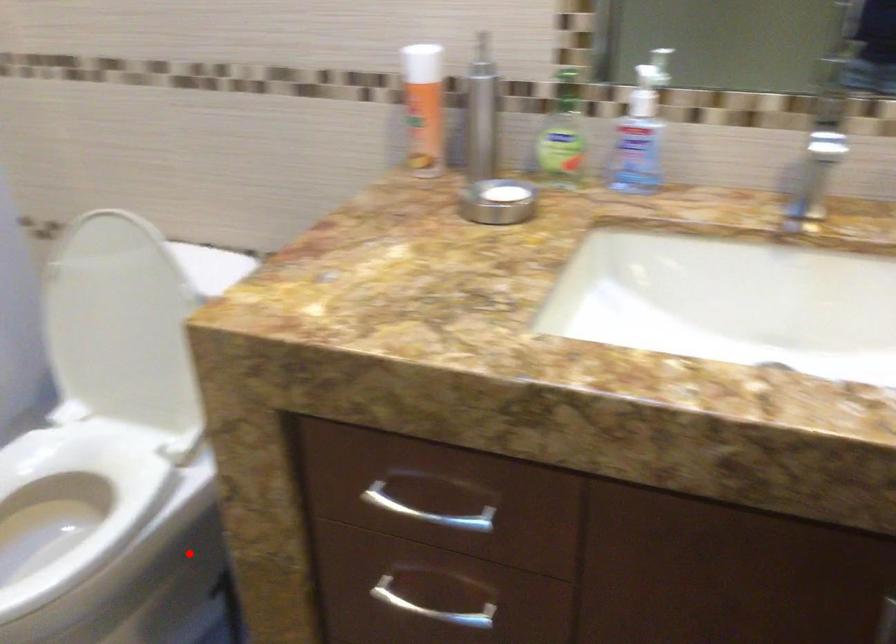
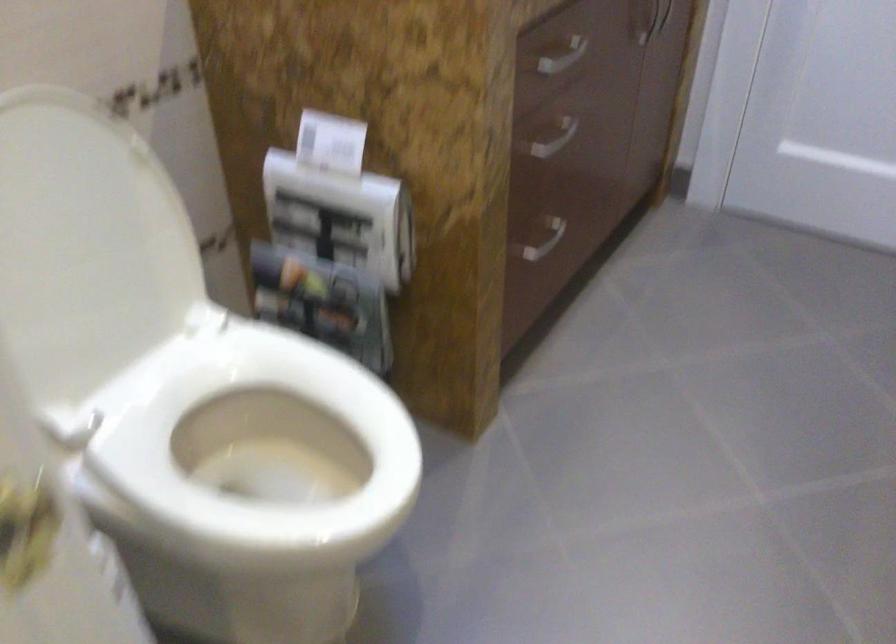
Find the pixel in the second image that matches the highlighted location in the first image.

(257, 438)